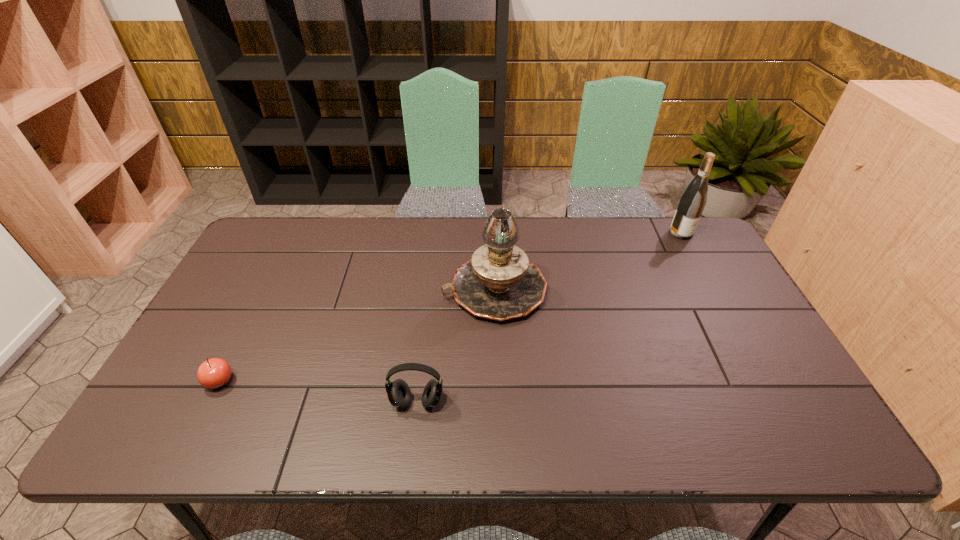
This screenshot has height=540, width=960. What are the coordinates of `the farthest object` in the screenshot? It's located at (693, 200).

Where is `wine bottle`? wine bottle is located at coordinates (693, 200).

Identify the location of the third nearest object. The height and width of the screenshot is (540, 960). (498, 282).

Find the location of `the second shortest object`. the second shortest object is located at coordinates (398, 392).

Locate an element on the screen. apple is located at coordinates (213, 373).

Identify the location of the shortest object. (213, 373).

Find the location of `vacant space located on the left of the wine bottle`. vacant space located on the left of the wine bottle is located at coordinates (588, 233).

You are a GUI agent. You are given a task and a screenshot of the screen. Output one action in this format:
    pyautogui.click(x=<x>, y=<y>)
    Task: Click on the vacant space positioned 0.100m on the front of the oil lamp
    
    Given the screenshot: What is the action you would take?
    pyautogui.click(x=497, y=355)

The image size is (960, 540). Identify the location of free space located on the back of the shortest object. (234, 353).

The height and width of the screenshot is (540, 960). Identify the location of wine bottle that is at the far edge. (693, 200).